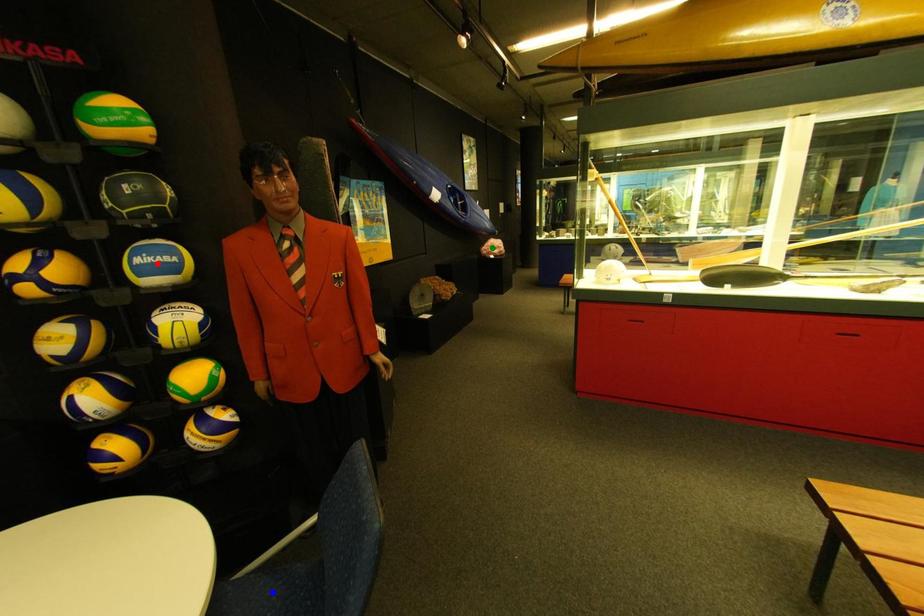
Order these from nearest to farthest:
red point
green point
blue point

1. blue point
2. red point
3. green point